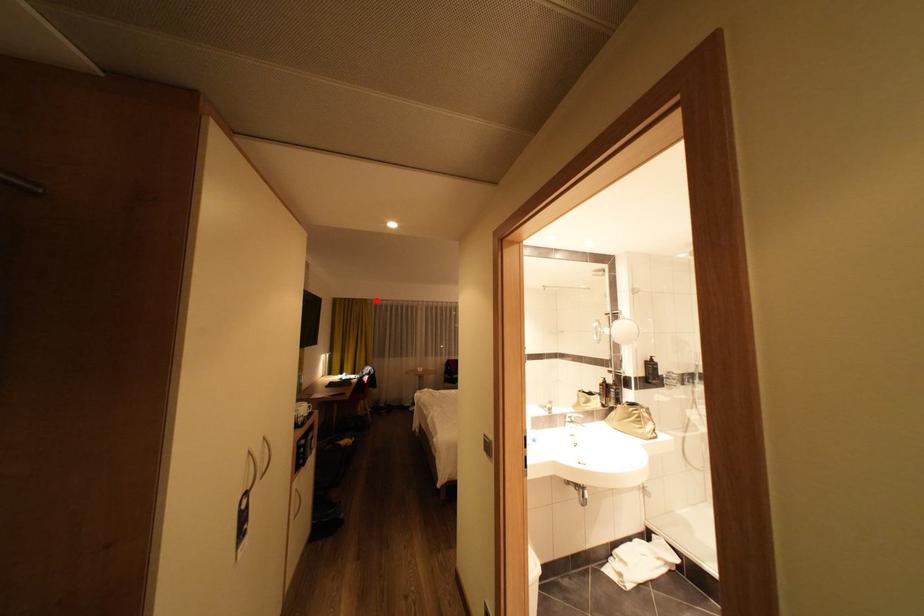
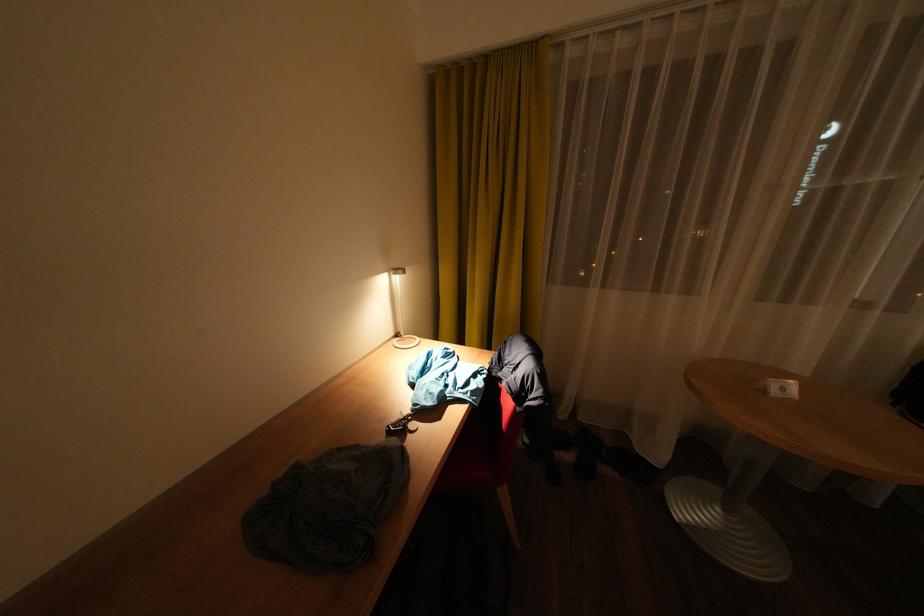
Where in the second image is the point corresponding to the highlighted location from the first image?

(544, 47)